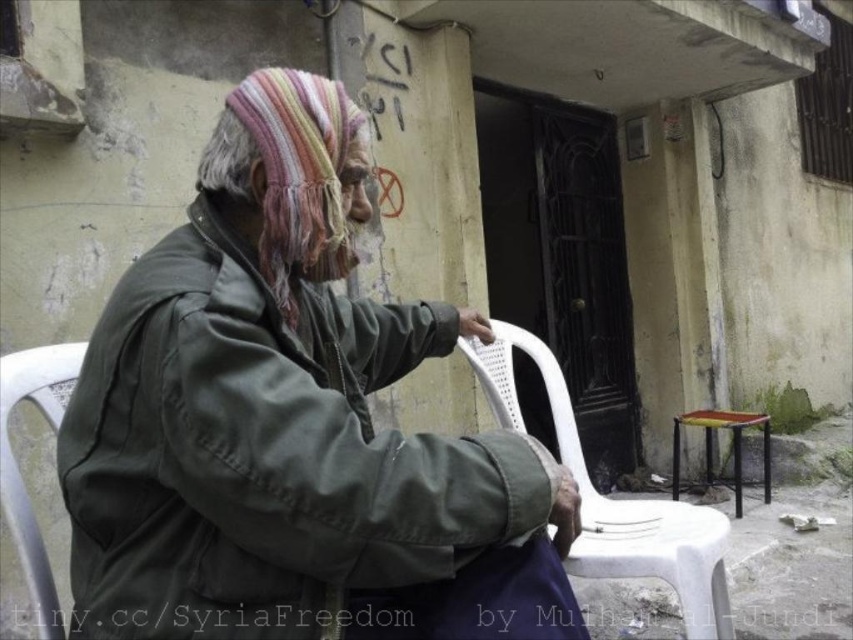
You are a delivery person who needs to place a small package between the white plastic chair at lower left and the yellow plastic stool at lower right. Based on the scene, can you confirm if there is enough space between them for the package?

The white plastic chair at lower left is to the left of yellow plastic stool at lower right, so there is space between them to place the package.

You are a delivery person who needs to place a heavy package on the ground near the white plastic chair at lower right and yellow plastic stool at lower right. Which object should you move to make space?

The white plastic chair at lower right has a larger size compared to yellow plastic stool at lower right, so you should move the yellow plastic stool at lower right to make space for the package.

You are a photographer trying to capture the elderly man in the scene. You need to ensure both the green matte jacket at center and the white plastic chair at lower left are visible in your shot. Based on their positions, which object should you frame first to include both?

The green matte jacket at center is positioned on the right side of white plastic chair at lower left. To include both in the shot, you should frame the white plastic chair at lower left first since it is on the left side, allowing the green matte jacket at center to naturally fall into the frame on its right.